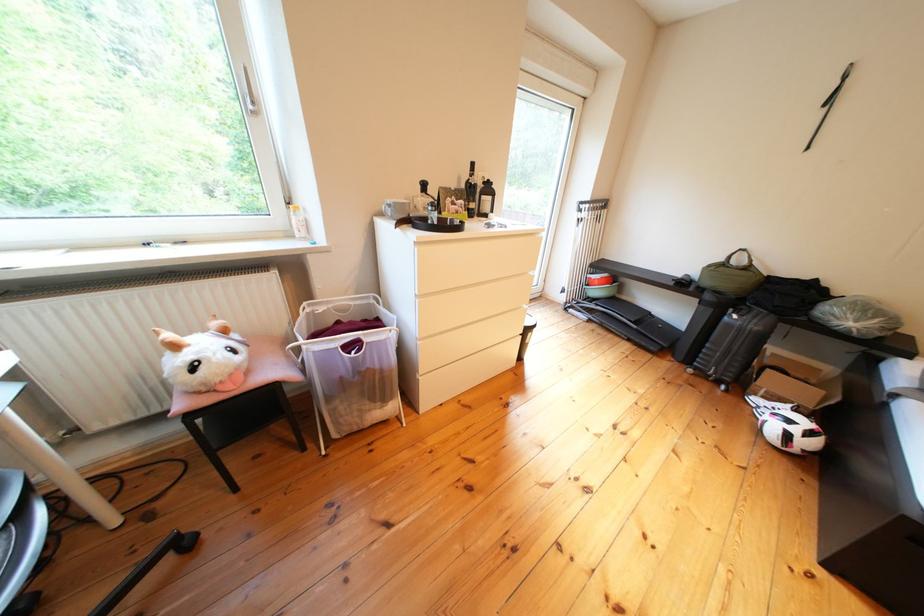
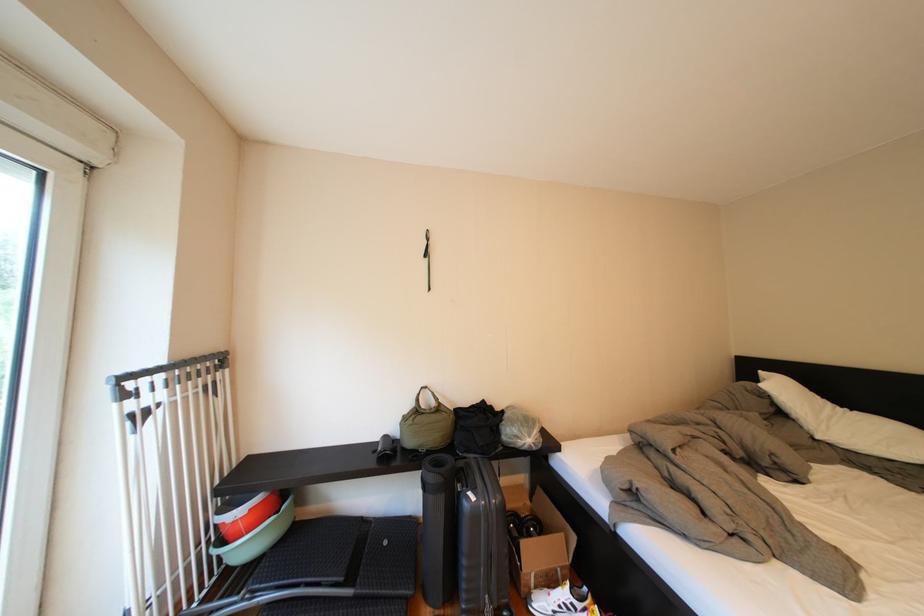
The point at (786, 386) is marked in the first image. Where is the corresponding point in the second image?

(544, 557)